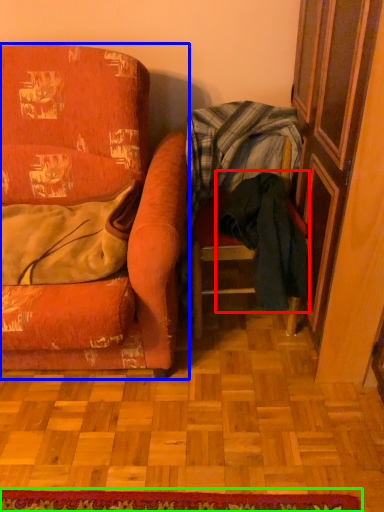
Question: Which object is the farthest from clothing (highlighted by a red box)? Choose among these: chair (highlighted by a blue box) or doormat (highlighted by a green box).

Choices:
 (A) chair
 (B) doormat

Answer: (B)